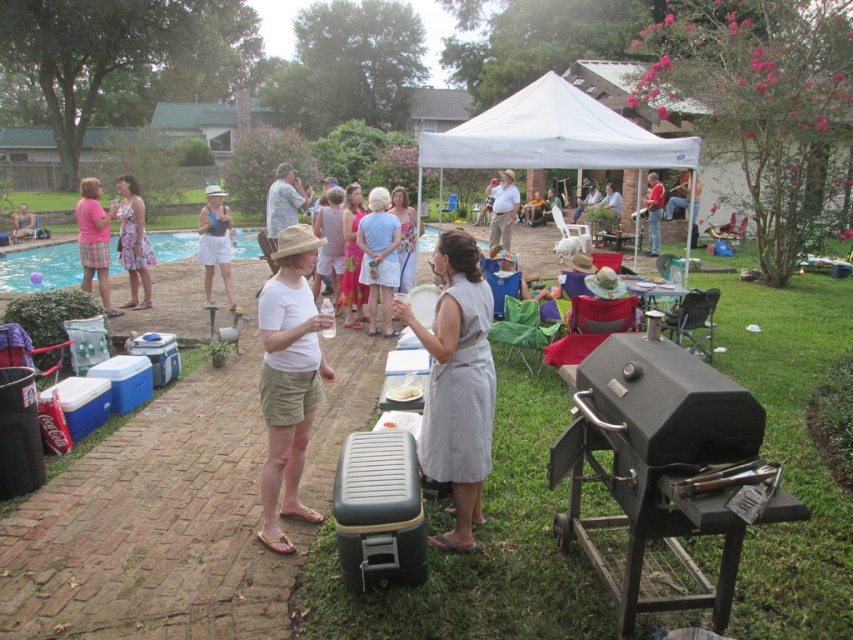
You are at a backyard barbecue and see two people wearing a light brown fabric shirt at center and a red shirt at upper center. Which shirt is positioned to the left of the other?

The light brown fabric shirt at center is positioned to the left of the red shirt at upper center.